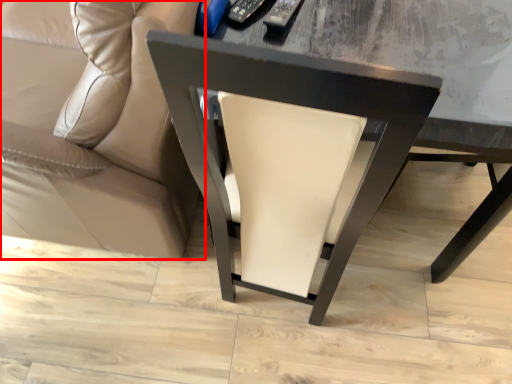
Question: In this image, where is studio couch (annotated by the red box) located relative to chair?

Choices:
 (A) left
 (B) right

Answer: (A)